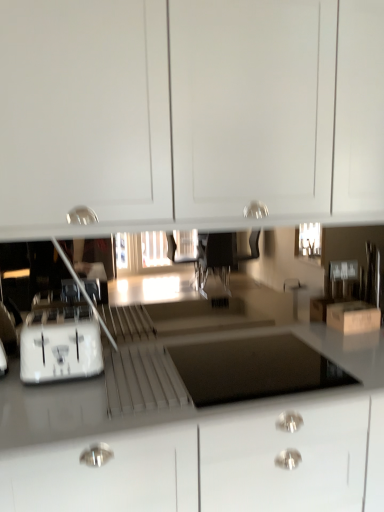
At what (x,y) coordinates should I click in order to perform the action: click on blank space above white plastic drawer at center (from a real-world perspective). Please return your answer as a coordinate pair (x, y). The height and width of the screenshot is (512, 384). Looking at the image, I should click on (216, 365).